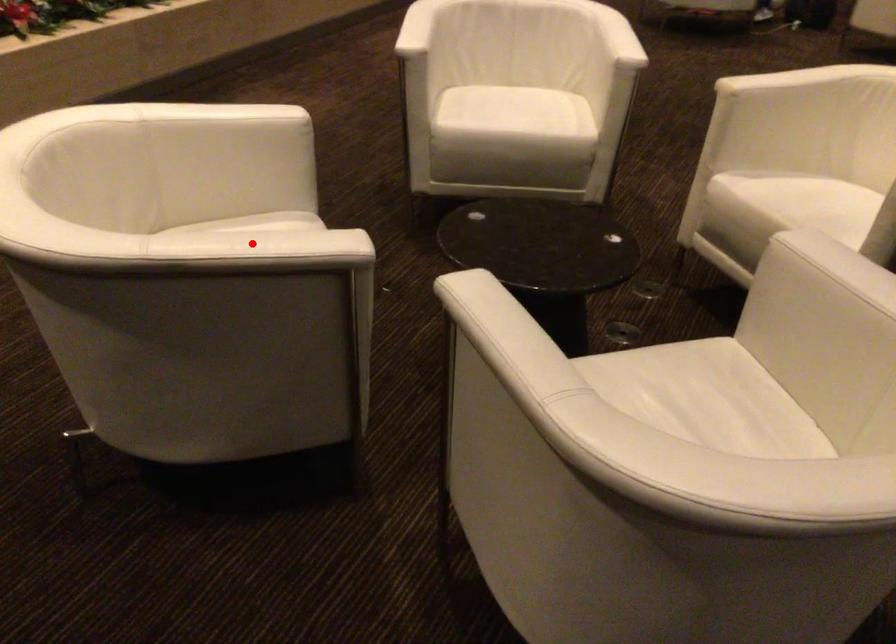
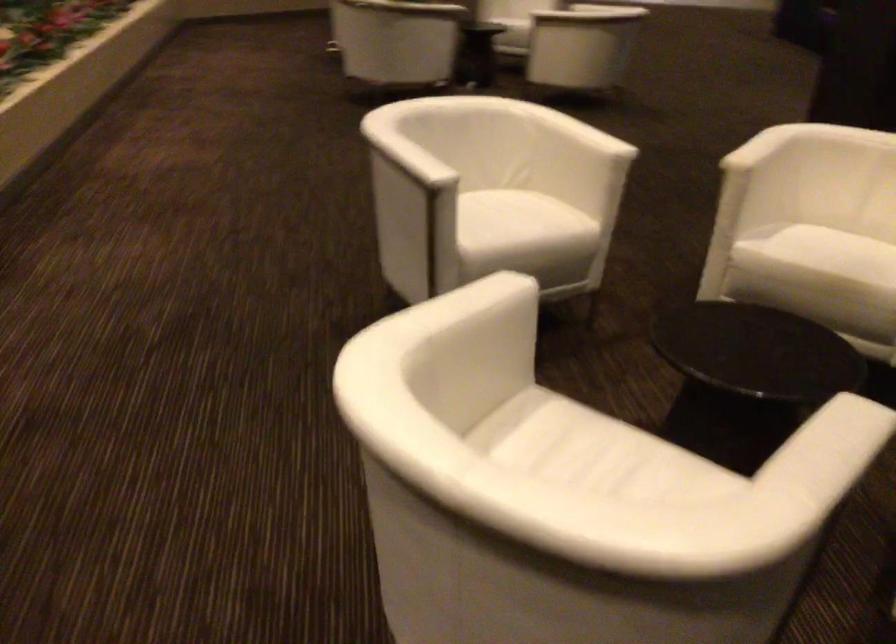
Question: A red point is marked in image1. In image2, is the corresponding 3D point closer to the camera or farther? Reply with the corresponding letter.

Choices:
 (A) The corresponding 3D point is closer.
 (B) The corresponding 3D point is farther.

Answer: (A)